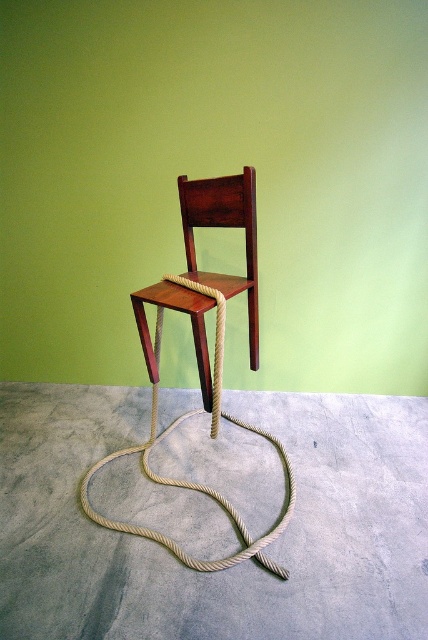
Question: Considering the real-world distances, which object is closest to the mahogany wood chair at center?

Choices:
 (A) wooden chair at center
 (B) natural beige rope at center

Answer: (A)

Question: Can you confirm if mahogany wood chair at center is positioned to the right of natural beige rope at center?

Choices:
 (A) no
 (B) yes

Answer: (B)

Question: Which of the following is the farthest from the observer?

Choices:
 (A) mahogany wood chair at center
 (B) natural beige rope at center

Answer: (B)

Question: Which of the following is the farthest from the observer?

Choices:
 (A) wooden chair at center
 (B) mahogany wood chair at center
 (C) natural beige rope at center

Answer: (C)

Question: Does natural beige rope at center have a greater width compared to wooden chair at center?

Choices:
 (A) no
 (B) yes

Answer: (B)

Question: From the image, what is the correct spatial relationship of natural beige rope at center in relation to wooden chair at center?

Choices:
 (A) right
 (B) left

Answer: (A)